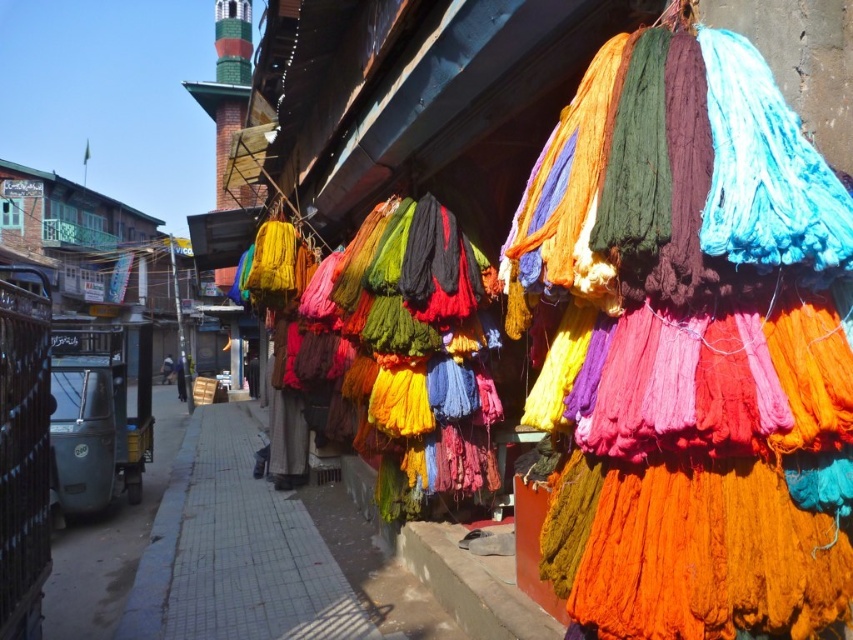
Question: Does bright multicolored yarn at right appear under gray concrete pavement at lower left?

Choices:
 (A) no
 (B) yes

Answer: (A)

Question: Is gray tile pavement at center thinner than gray concrete pavement at lower left?

Choices:
 (A) yes
 (B) no

Answer: (A)

Question: Which of the following is the closest to the observer?

Choices:
 (A) (67, 632)
 (B) (560, 227)
 (C) (289, 563)

Answer: (B)

Question: Can you confirm if bright multicolored yarn at right is bigger than gray tile pavement at center?

Choices:
 (A) no
 (B) yes

Answer: (A)

Question: Estimate the real-world distances between objects in this image. Which object is farther from the gray concrete pavement at lower left?

Choices:
 (A) gray tile pavement at center
 (B) bright multicolored yarn at right

Answer: (B)

Question: Which of these objects is positioned closest to the gray concrete pavement at lower left?

Choices:
 (A) gray tile pavement at center
 (B) bright multicolored yarn at right

Answer: (A)